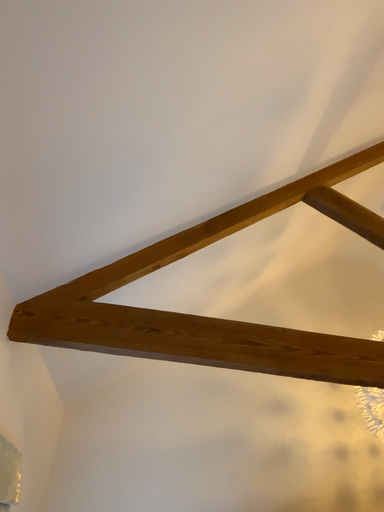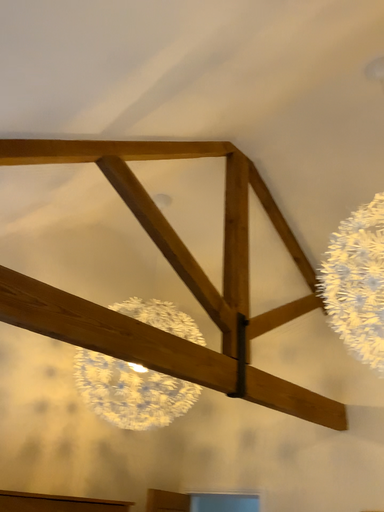
Question: Which way did the camera rotate in the video?

Choices:
 (A) rotated upward
 (B) rotated downward

Answer: (B)